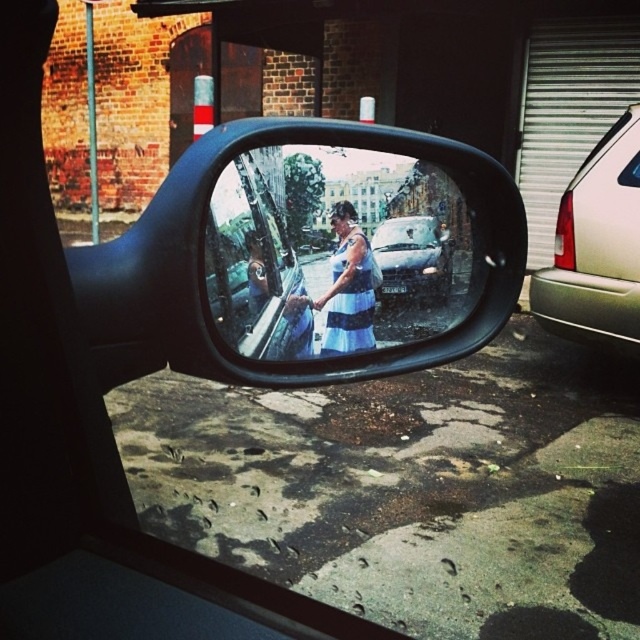
Can you confirm if metallic silver car at right is bigger than metallic silver car at center?

Yes, metallic silver car at right is bigger than metallic silver car at center.

Is point (536, 316) in front of point (390, 282)?

No.

Is point (582, 276) more distant than point (436, 276)?

Yes.

Image resolution: width=640 pixels, height=640 pixels. I want to click on metallic silver car at right, so click(596, 248).

Which is more to the right, blue striped dress at center or metallic silver car at center?

metallic silver car at center is more to the right.

Does blue striped dress at center have a greater width compared to metallic silver car at center?

Indeed, blue striped dress at center has a greater width compared to metallic silver car at center.

Is point (317, 216) behind point (442, 237)?

No.

You are a GUI agent. You are given a task and a screenshot of the screen. Output one action in this format:
    pyautogui.click(x=<x>, y=<y>)
    Task: Click on the blue striped dress at center
    The height and width of the screenshot is (640, 640).
    Given the screenshot: What is the action you would take?
    pyautogui.click(x=333, y=252)

What do you see at coordinates (596, 248) in the screenshot? I see `metallic silver car at right` at bounding box center [596, 248].

Does metallic silver car at right lie in front of striped fabric dress at center?

No, it is behind striped fabric dress at center.

Between point (632, 284) and point (342, 214), which one is positioned behind?

Positioned behind is point (632, 284).

Where is `metallic silver car at right`? metallic silver car at right is located at coordinates point(596,248).